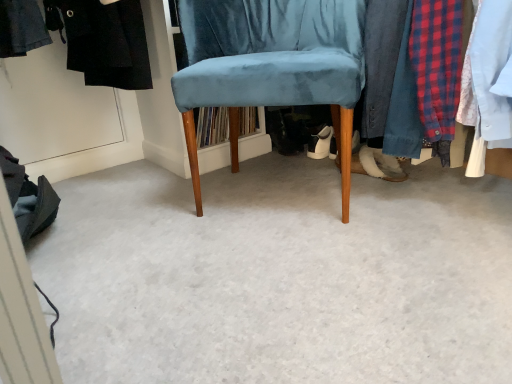
This screenshot has width=512, height=384. Identify the location of vacant space underneath velvet blue chair at center (from a real-world perspective). (280, 190).